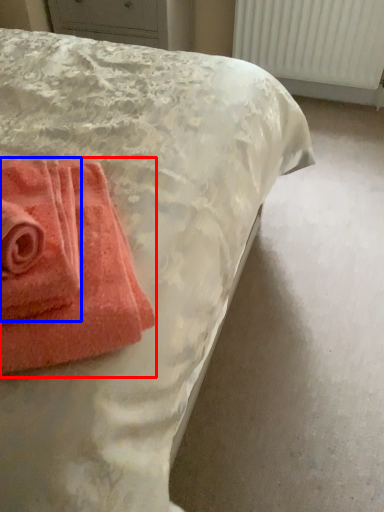
Question: Which object is closer to the camera taking this photo, towel (highlighted by a red box) or towel (highlighted by a blue box)?

Choices:
 (A) towel
 (B) towel

Answer: (A)